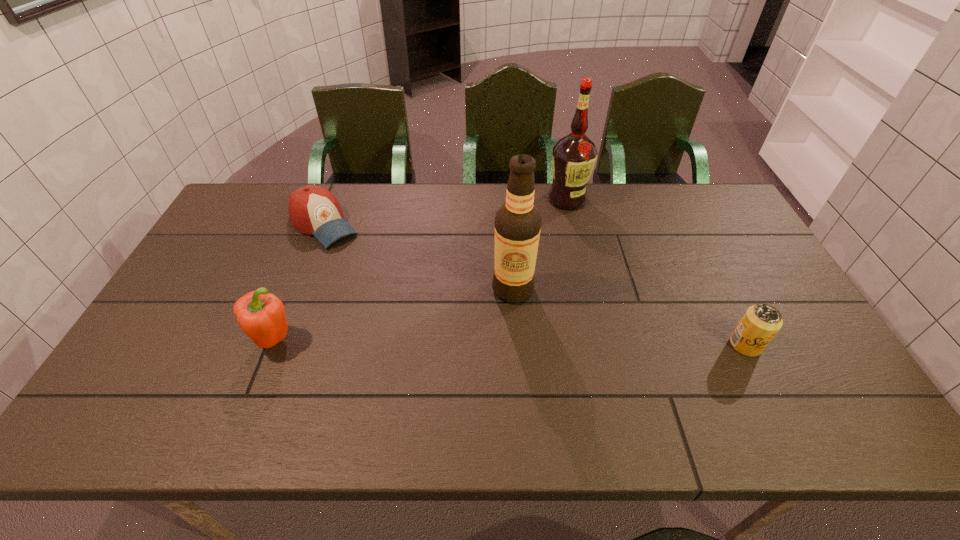
At what (x,y) coordinates should I click in order to perform the action: click on object positioned at the right edge. Please return your answer as a coordinate pair (x, y). This screenshot has width=960, height=540. Looking at the image, I should click on (761, 322).

The height and width of the screenshot is (540, 960). In the image, there is a desktop. Find the location of `vacant area at the far edge`. vacant area at the far edge is located at coordinates (406, 222).

In the image, there is a desktop. Where is `free space at the near edge`? The image size is (960, 540). free space at the near edge is located at coordinates (333, 391).

You are a GUI agent. You are given a task and a screenshot of the screen. Output one action in this format:
    pyautogui.click(x=<x>, y=<y>)
    Task: Click on the vacant space at the right edge of the desktop
    The image size is (960, 540).
    Given the screenshot: What is the action you would take?
    pyautogui.click(x=714, y=248)

Find the location of a particular element. vacant space at the far left corner of the desktop is located at coordinates (266, 222).

Locate an element on the screen. free space between the baseball cap and the pepper is located at coordinates (299, 282).

I want to click on free space between the baseball cap and the pepper, so click(x=299, y=282).

Where is `vacant area that lies between the pepper and the beer can`? vacant area that lies between the pepper and the beer can is located at coordinates (510, 342).

Where is `vacant space that is in between the pepper and the baseball cap`? This screenshot has height=540, width=960. vacant space that is in between the pepper and the baseball cap is located at coordinates (299, 282).

Locate an element on the screen. vacant point located between the second object from right to left and the third object from left to right is located at coordinates (540, 244).